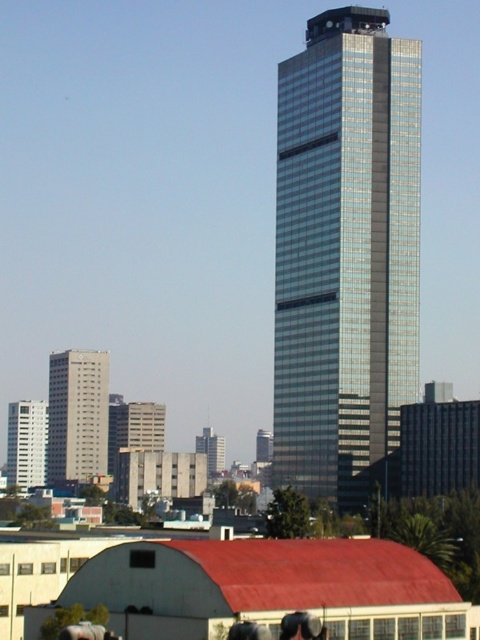
You are a drone operator trying to deliver a package from the gray concrete building at left to the smooth black hair at lower center. The drone has a maximum range of 300 meters. Can the drone make the delivery without needing a recharge?

The gray concrete building at left and smooth black hair at lower center are 353.92 meters apart, which exceeds the drone delivery range of 300 meters. The drone cannot make the delivery without needing a recharge.

In the scene shown: You are a city planner analyzing the layout of the city. You need to determine which of the two buildings at the left side of the image has a greater width. The buildings in question are the gray concrete building at left and the white glossy building at left. Can you identify which one is wider?

The gray concrete building at left has a larger width than the white glossy building at left according to the description.

You are a drone operator tasked with capturing aerial footage of the city. Your drone can fly up to 400 meters away from its starting position. If you position yourself at the starting point, will the gray concrete building at left be within the drone camera range?

The gray concrete building at left is 397.17 meters away from the camera, which is within the drone camera range of 400 meters. The drone can capture the gray concrete building at left.